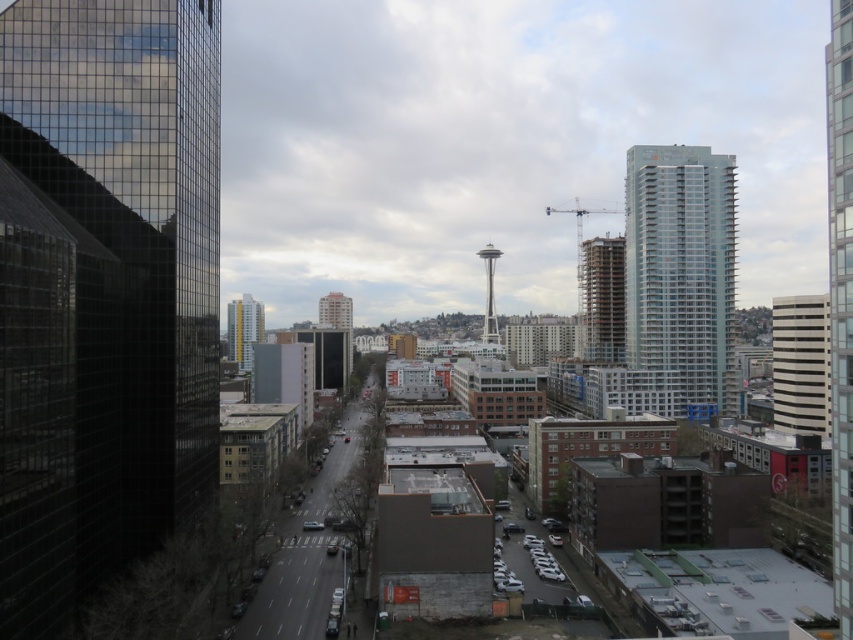
Question: Among these objects, which one is farthest from the camera?

Choices:
 (A) black glass skyscraper at left
 (B) glassy reflective skyscraper at right

Answer: (B)

Question: Which object is positioned closest to the glassy reflective skyscraper at right?

Choices:
 (A) glassy silver skyscraper at right
 (B) white textured building at right
 (C) matte glass building at center

Answer: (B)

Question: Does glassy silver skyscraper at right appear over matte glass building at center?

Choices:
 (A) no
 (B) yes

Answer: (B)

Question: Does glassy silver skyscraper at right have a lesser width compared to glassy reflective skyscraper at right?

Choices:
 (A) no
 (B) yes

Answer: (B)

Question: Does matte glass building at center appear on the left side of light brown concrete building at center?

Choices:
 (A) yes
 (B) no

Answer: (B)

Question: Which object appears closest to the camera in this image?

Choices:
 (A) glassy silver skyscraper at right
 (B) yellow glass tower at center
 (C) light brown concrete building at center
 (D) glassy reflective skyscraper at right

Answer: (D)